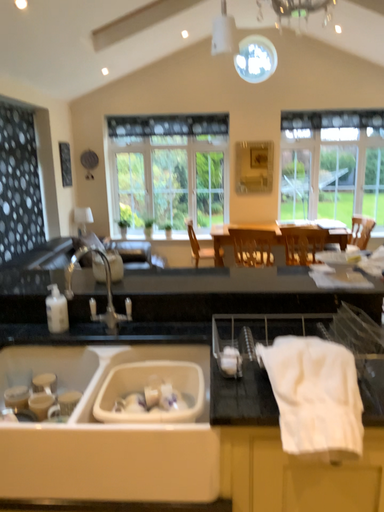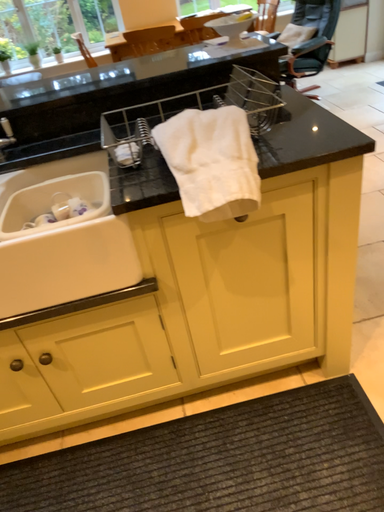
Question: How did the camera likely rotate when shooting the video?

Choices:
 (A) rotated downward
 (B) rotated upward

Answer: (A)